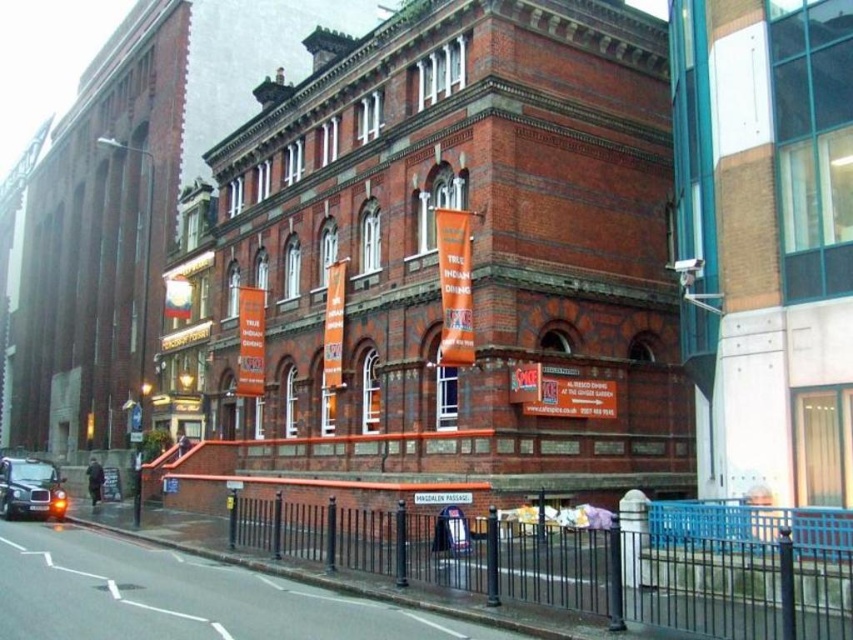
Is point (766, 600) behind point (18, 506)?

No, (766, 600) is closer to viewer.

Does black metal fence at lower center have a larger size compared to black matte taxi cab at lower left?

Actually, black metal fence at lower center might be smaller than black matte taxi cab at lower left.

Which is behind, point (372, 540) or point (32, 465)?

Positioned behind is point (32, 465).

This screenshot has height=640, width=853. What are the coordinates of `black metal fence at lower center` in the screenshot? It's located at (584, 564).